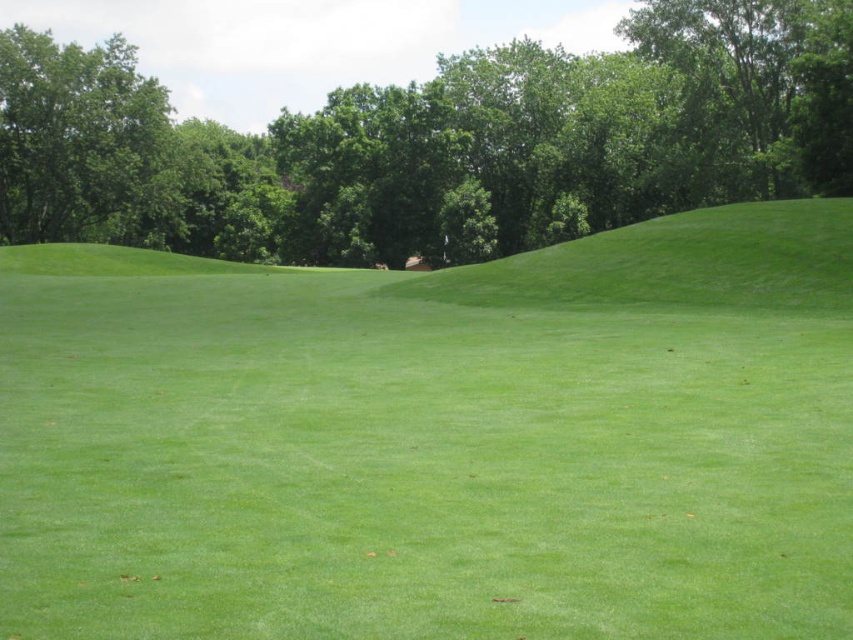
Question: Can you confirm if green grassy hillside at upper right is positioned below green leafy tree at upper left?

Choices:
 (A) no
 (B) yes

Answer: (B)

Question: Which point is farther from the camera taking this photo?

Choices:
 (A) (831, 493)
 (B) (759, 216)

Answer: (B)

Question: Based on their relative distances, which object is nearer to the green leafy tree at upper left?

Choices:
 (A) green leafy tree at upper center
 (B) green grass at center
 (C) green grassy hillside at upper right

Answer: (A)

Question: Which object is farther from the camera taking this photo?

Choices:
 (A) green leafy tree at upper center
 (B) green leafy tree at upper left

Answer: (B)

Question: Can you confirm if green grass at center is smaller than green leafy tree at upper left?

Choices:
 (A) yes
 (B) no

Answer: (A)

Question: In this image, where is green grass at center located relative to green leafy tree at upper center?

Choices:
 (A) below
 (B) above

Answer: (A)